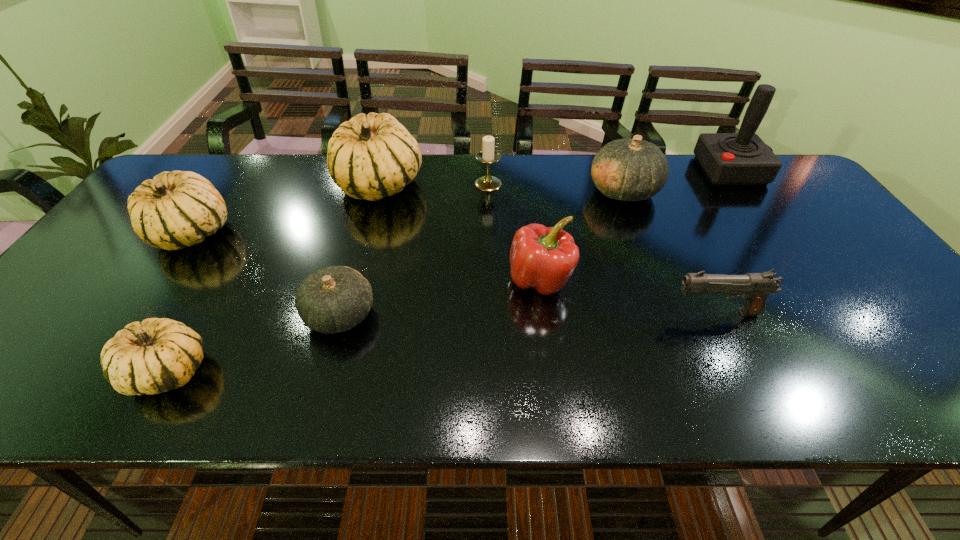
Locate an element on the screen. The height and width of the screenshot is (540, 960). gourd that stands as the fourth closest to the pepper is located at coordinates (156, 355).

At what (x,y) coordinates should I click in order to perform the action: click on the third closest white gourd to the rightmost gourd. Please return your answer as a coordinate pair (x, y). This screenshot has width=960, height=540. Looking at the image, I should click on (176, 209).

Where is `white gourd that is the closest to the tallest object`? white gourd that is the closest to the tallest object is located at coordinates (373, 156).

Image resolution: width=960 pixels, height=540 pixels. What are the coordinates of `vacant space that satisfies the following two spatial constraints: 1. on the back side of the nearest white gourd; 2. on the right side of the smaller orange gourd` in the screenshot? It's located at (201, 315).

Find the location of a particular element. free space that satisfies the following two spatial constraints: 1. on the base of the rightmost object; 2. on the front side of the nearer orange gourd is located at coordinates (832, 315).